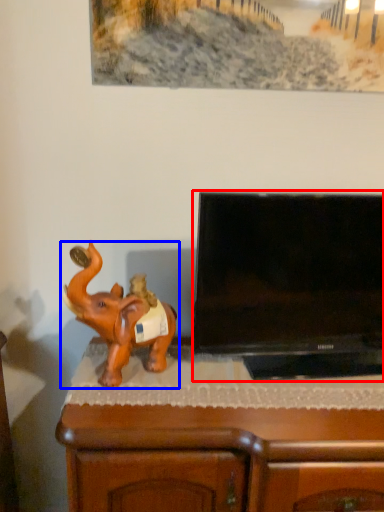
Question: Among these objects, which one is farthest to the camera, television (highlighted by a red box) or elephant (highlighted by a blue box)?

Choices:
 (A) television
 (B) elephant

Answer: (A)